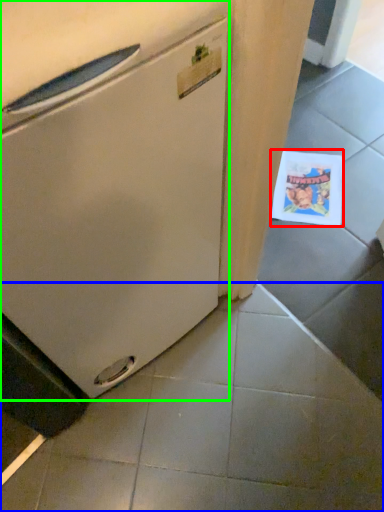
Question: Estimate the real-world distances between objects in this image. Which object is farther from postcard (highlighted by a red box), tile (highlighted by a blue box) or refrigerator (highlighted by a green box)?

Choices:
 (A) tile
 (B) refrigerator

Answer: (B)